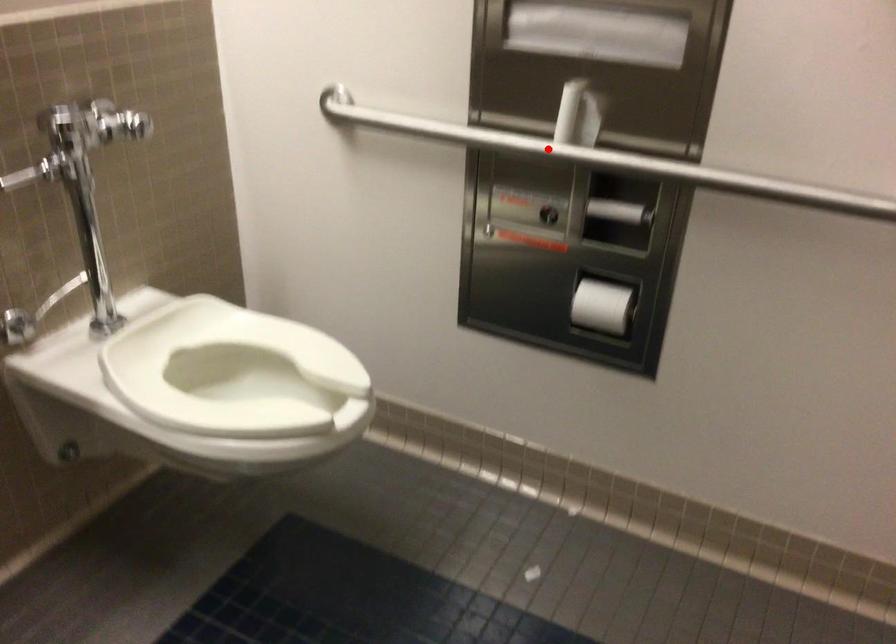
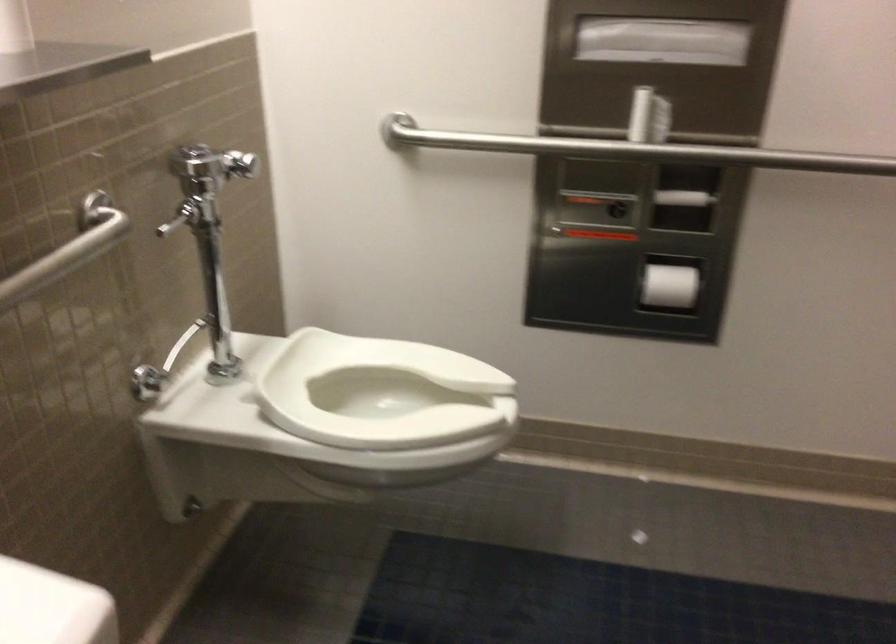
Question: A red point is marked in image1. In image2, is the corresponding 3D point closer to the camera or farther? Reply with the corresponding letter.

Choices:
 (A) The corresponding 3D point is closer.
 (B) The corresponding 3D point is farther.

Answer: (B)